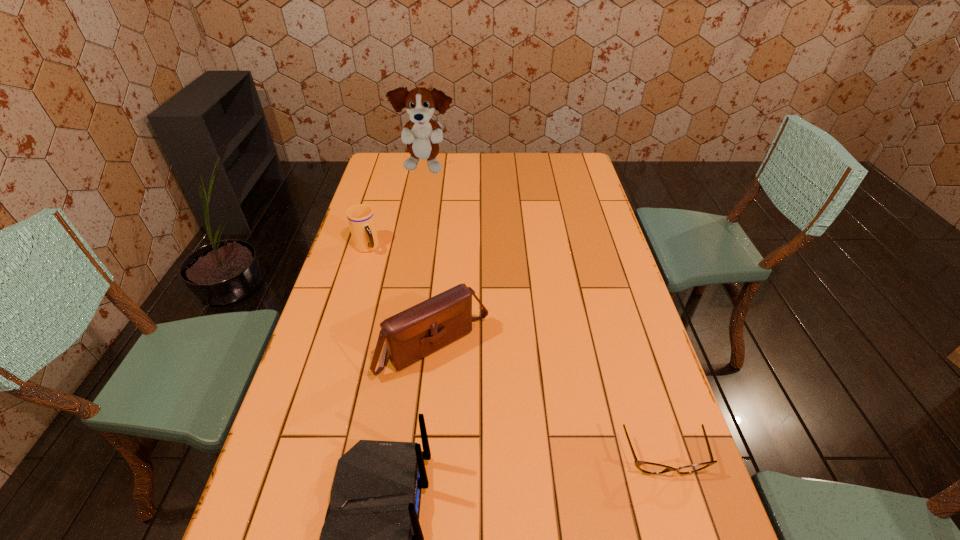
Where is `vacant spot on the desktop that is between the router and the rightmost object and is positioned on the front flap of the third shortest object`? Image resolution: width=960 pixels, height=540 pixels. vacant spot on the desktop that is between the router and the rightmost object and is positioned on the front flap of the third shortest object is located at coordinates (545, 482).

Identify the location of free space on the desktop that is between the second tallest object and the spectacles and is positioned on the side of the fourth tallest object with the handle. (534, 484).

At what (x,y) coordinates should I click in order to perform the action: click on vacant spot on the desktop that is between the fourth shortest object and the shortest object and is positioned on the face of the farthest object. Please return your answer as a coordinate pair (x, y). The height and width of the screenshot is (540, 960). Looking at the image, I should click on (519, 487).